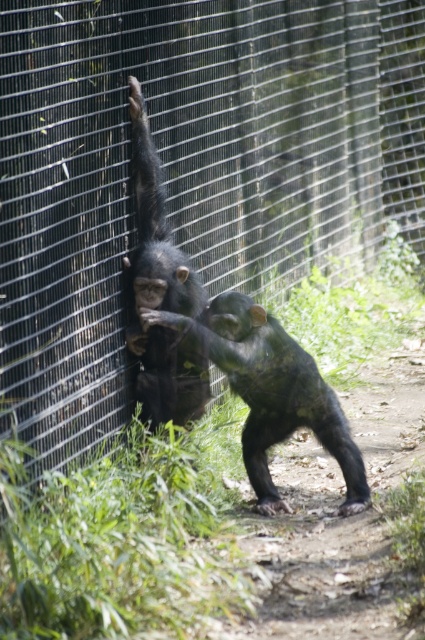
Question: Can you confirm if dark brown fur monkey at center is positioned below shiny black monkey at left?

Choices:
 (A) no
 (B) yes

Answer: (B)

Question: Does dark brown fur monkey at center have a smaller size compared to shiny black monkey at left?

Choices:
 (A) no
 (B) yes

Answer: (A)

Question: Can you confirm if dark brown fur monkey at center is wider than shiny black monkey at left?

Choices:
 (A) no
 (B) yes

Answer: (B)